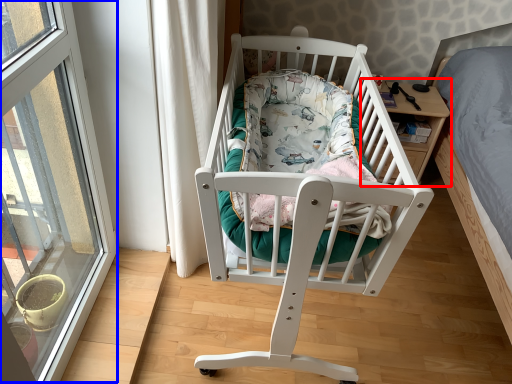
Question: Which object appears closest to the camera in this image, table (highlighted by a red box) or window (highlighted by a blue box)?

Choices:
 (A) table
 (B) window

Answer: (B)